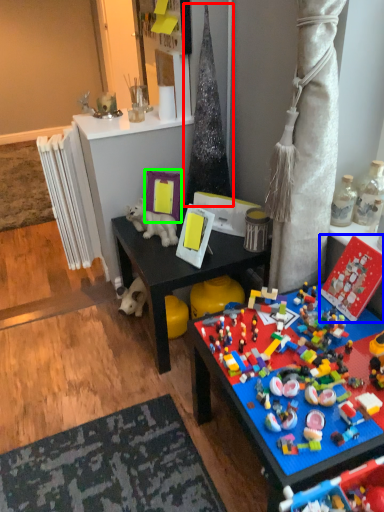
Question: Which is farther away from christmas tree (highlighted by a red box)? toy (highlighted by a blue box) or picture frame (highlighted by a green box)?

Choices:
 (A) toy
 (B) picture frame

Answer: (A)